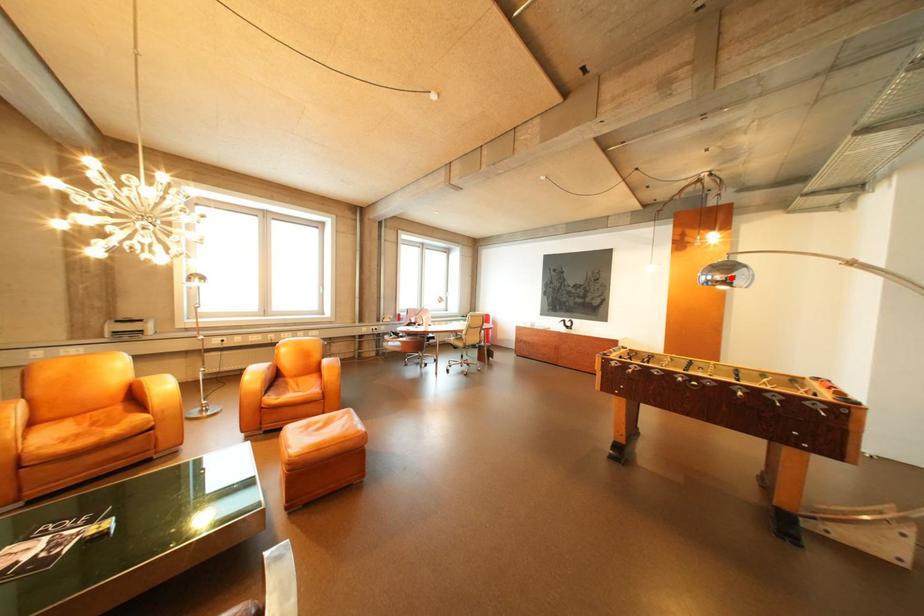
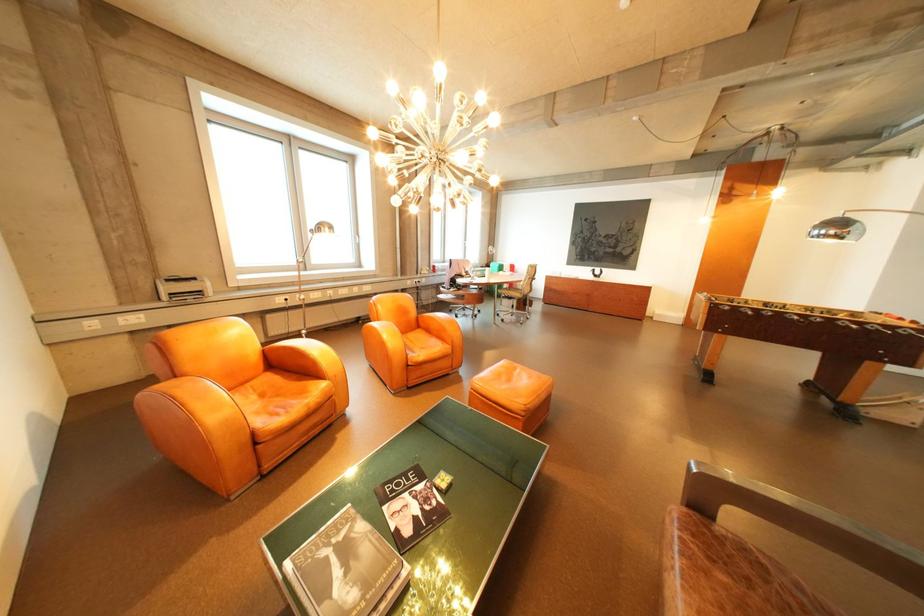
Question: I am providing you with two images of the same scene from different viewpoints. A red point is marked on the first image. Can you still see the location of the red point in image 2?

Choices:
 (A) Yes
 (B) No

Answer: (A)